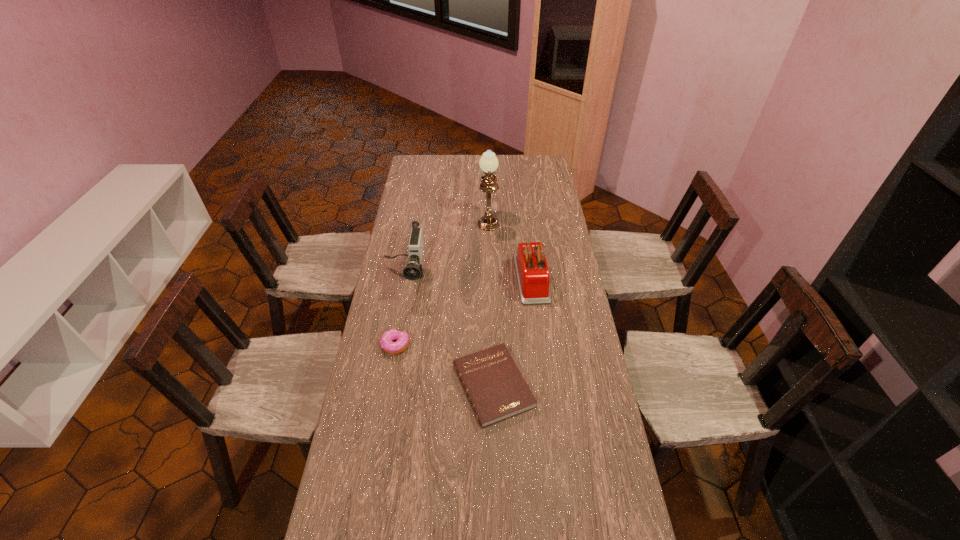
Locate an element on the screen. The width and height of the screenshot is (960, 540). vacant area situated on the front of the shortest object is located at coordinates (494, 449).

Image resolution: width=960 pixels, height=540 pixels. What are the coordinates of `camcorder at the left edge` in the screenshot? It's located at click(413, 271).

Locate an element on the screen. The image size is (960, 540). doughnut that is at the left edge is located at coordinates (386, 342).

Where is `object present at the right edge`? The width and height of the screenshot is (960, 540). object present at the right edge is located at coordinates (533, 277).

At what (x,y) coordinates should I click in order to perform the action: click on free location at the far edge. Please return your answer as a coordinate pair (x, y). Image resolution: width=960 pixels, height=540 pixels. Looking at the image, I should click on (475, 167).

What are the coordinates of `free space at the left edge of the desktop` in the screenshot? It's located at (398, 315).

At what (x,y) coordinates should I click in order to perform the action: click on free space at the right edge of the desktop. Please return your answer as a coordinate pair (x, y). Looking at the image, I should click on pos(528,181).

Where is `vacant position at the far right corner of the desktop`? The height and width of the screenshot is (540, 960). vacant position at the far right corner of the desktop is located at coordinates (523, 165).

Locate an element on the screen. free space that is in between the toaster and the fourth tallest object is located at coordinates (464, 312).

Identify the location of free spot between the shortest object and the tallest object. The height and width of the screenshot is (540, 960). (491, 302).